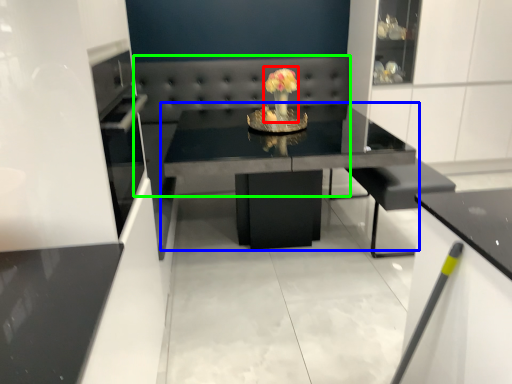
Question: Considering the real-world distances, which object is farthest from floral arrangement (highlighted by a red box)? table (highlighted by a blue box) or couch (highlighted by a green box)?

Choices:
 (A) table
 (B) couch

Answer: (A)